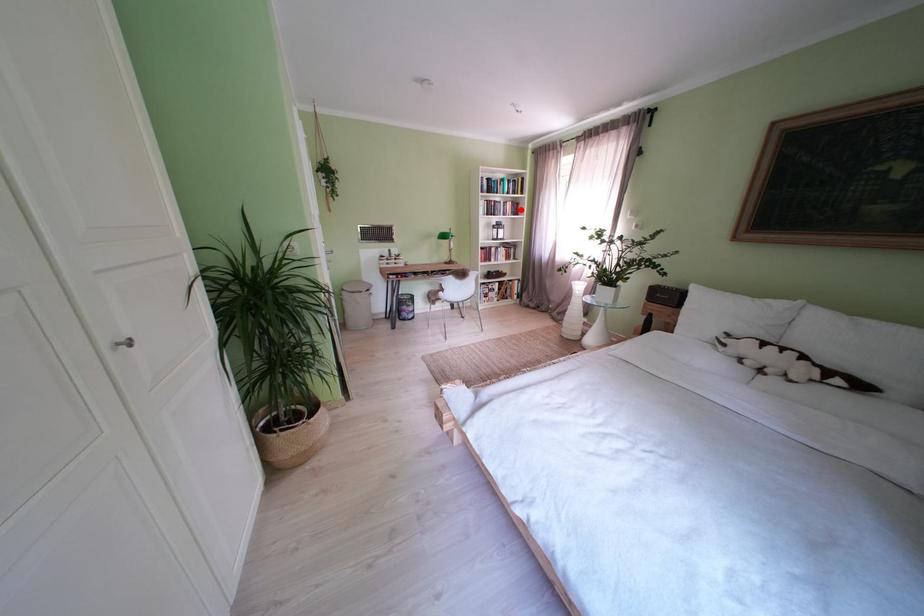
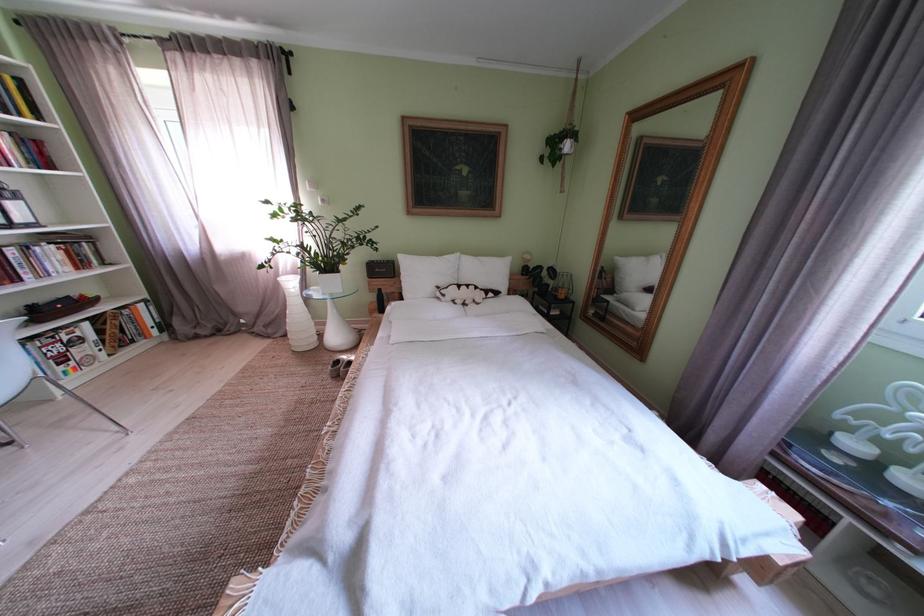
Question: I am providing you with two images of the same scene from different viewpoints. In image1, a red point is highlighted. Considering the same 3D point in image2, which of the following is correct?

Choices:
 (A) It is closer
 (B) It is farther

Answer: (B)